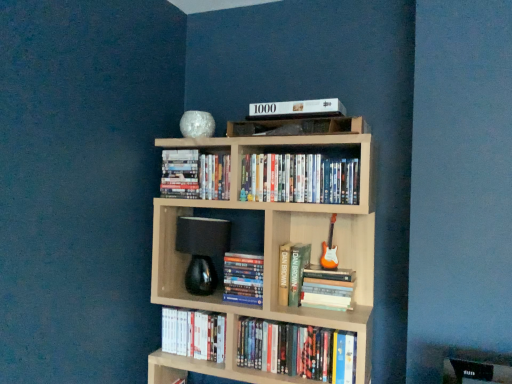
Question: Is hardcover book at center, which is the third book from bottom to top, positioned beyond the bounds of hardcover books at lower center, marked as the first book in a bottom-to-top arrangement?

Choices:
 (A) no
 (B) yes

Answer: (B)

Question: Does hardcover book at center, the sixth book positioned from the top, have a lesser height compared to hardcover books at lower center, marked as the first book in a bottom-to-top arrangement?

Choices:
 (A) no
 (B) yes

Answer: (B)

Question: From a real-world perspective, is hardcover book at center, which is the third book from bottom to top, physically below hardcover books at lower center, marked as the eighth book in a top-to-bottom arrangement?

Choices:
 (A) yes
 (B) no

Answer: (B)

Question: Does hardcover book at center, which is the third book from bottom to top, have a greater height compared to hardcover books at lower center, marked as the first book in a bottom-to-top arrangement?

Choices:
 (A) yes
 (B) no

Answer: (B)

Question: Is hardcover book at center, the sixth book positioned from the top, positioned before hardcover books at lower center, marked as the eighth book in a top-to-bottom arrangement?

Choices:
 (A) yes
 (B) no

Answer: (B)

Question: Considering the positions of light wood bookcase at center and hardcover book at center, the 4th book positioned from the top, in the image, is light wood bookcase at center bigger or smaller than hardcover book at center, the 4th book positioned from the top,?

Choices:
 (A) small
 (B) big

Answer: (B)

Question: From a real-world perspective, is light wood bookcase at center physically located above or below hardcover book at center, the 4th book positioned from the top?

Choices:
 (A) below
 (B) above

Answer: (A)

Question: Is light wood bookcase at center inside or outside of hardcover book at center, the 4th book positioned from the top?

Choices:
 (A) outside
 (B) inside

Answer: (A)

Question: In the image, is light wood bookcase at center on the left side or the right side of hardcover book at center, positioned as the fifth book in bottom-to-top order?

Choices:
 (A) right
 (B) left

Answer: (B)

Question: From a real-world perspective, relative to hardcover book at center, acting as the fifth book starting from the top, is hardcover books at lower center, marked as the first book in a bottom-to-top arrangement, vertically above or below?

Choices:
 (A) below
 (B) above

Answer: (A)

Question: Based on their sizes in the image, would you say hardcover books at lower center, marked as the eighth book in a top-to-bottom arrangement, is bigger or smaller than hardcover book at center, acting as the fifth book starting from the top?

Choices:
 (A) big
 (B) small

Answer: (A)

Question: From the image's perspective, is hardcover books at lower center, marked as the first book in a bottom-to-top arrangement, located above or below hardcover book at center, which ranks as the 4th book in bottom-to-top order?

Choices:
 (A) above
 (B) below

Answer: (B)

Question: Is hardcover books at lower center, marked as the eighth book in a top-to-bottom arrangement, situated inside hardcover book at center, which ranks as the 4th book in bottom-to-top order, or outside?

Choices:
 (A) outside
 (B) inside

Answer: (A)

Question: Based on their sizes in the image, would you say hardcover book at upper center, positioned as the 2th book in top-to-bottom order, is bigger or smaller than white matte book at upper center, which is counted as the first book, starting from the top?

Choices:
 (A) big
 (B) small

Answer: (A)

Question: Is hardcover book at upper center, positioned as the 2th book in top-to-bottom order, wider or thinner than white matte book at upper center, which is counted as the first book, starting from the top?

Choices:
 (A) thin
 (B) wide

Answer: (A)